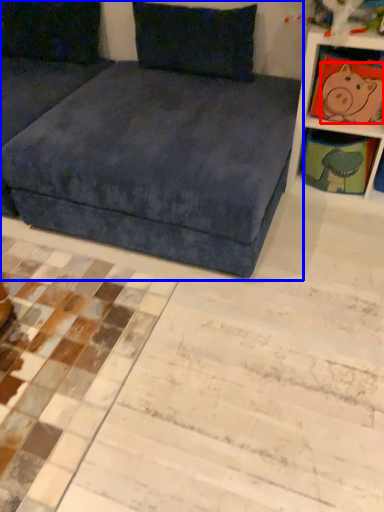
Question: Which object is further to the camera taking this photo, animal (highlighted by a red box) or studio couch (highlighted by a blue box)?

Choices:
 (A) animal
 (B) studio couch

Answer: (A)